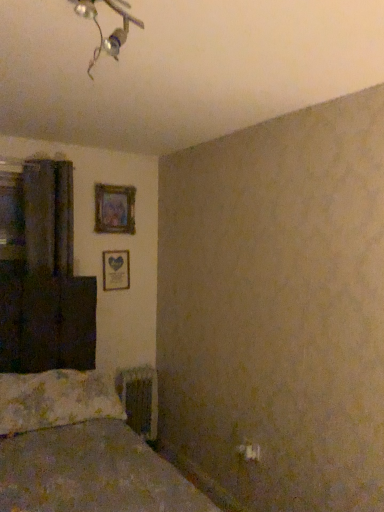
Question: Is the surface of metallic radiator at lower center in direct contact with fluffy white pillow at lower left?

Choices:
 (A) no
 (B) yes

Answer: (A)

Question: Is metallic radiator at lower center to the left of fluffy white pillow at lower left from the viewer's perspective?

Choices:
 (A) no
 (B) yes

Answer: (A)

Question: Is metallic radiator at lower center not inside fluffy white pillow at lower left?

Choices:
 (A) yes
 (B) no

Answer: (A)

Question: From a real-world perspective, is metallic radiator at lower center positioned under fluffy white pillow at lower left based on gravity?

Choices:
 (A) no
 (B) yes

Answer: (B)

Question: Can you confirm if metallic radiator at lower center is bigger than fluffy white pillow at lower left?

Choices:
 (A) yes
 (B) no

Answer: (B)

Question: Considering the positions of fluffy white pillow at lower left and dark matte curtain at left in the image, is fluffy white pillow at lower left wider or thinner than dark matte curtain at left?

Choices:
 (A) thin
 (B) wide

Answer: (B)

Question: From a real-world perspective, is fluffy white pillow at lower left positioned above or below dark matte curtain at left?

Choices:
 (A) below
 (B) above

Answer: (A)

Question: From their relative heights in the image, would you say fluffy white pillow at lower left is taller or shorter than dark matte curtain at left?

Choices:
 (A) short
 (B) tall

Answer: (A)

Question: From the image's perspective, is fluffy white pillow at lower left above or below dark matte curtain at left?

Choices:
 (A) above
 (B) below

Answer: (B)

Question: In terms of width, does metallic silver light fixture at upper center look wider or thinner when compared to dark matte curtain at left?

Choices:
 (A) thin
 (B) wide

Answer: (B)

Question: Is metallic silver light fixture at upper center to the left or to the right of dark matte curtain at left in the image?

Choices:
 (A) left
 (B) right

Answer: (B)

Question: From a real-world perspective, is metallic silver light fixture at upper center above or below dark matte curtain at left?

Choices:
 (A) below
 (B) above

Answer: (B)

Question: From the image's perspective, is metallic silver light fixture at upper center positioned above or below dark matte curtain at left?

Choices:
 (A) above
 (B) below

Answer: (A)

Question: From a real-world perspective, is wooden picture frame at center-left, which appears as the second picture frame when viewed from the top, physically located above or below metallic radiator at lower center?

Choices:
 (A) below
 (B) above

Answer: (B)

Question: From the image's perspective, is wooden picture frame at center-left, which appears as the second picture frame when viewed from the top, above or below metallic radiator at lower center?

Choices:
 (A) above
 (B) below

Answer: (A)